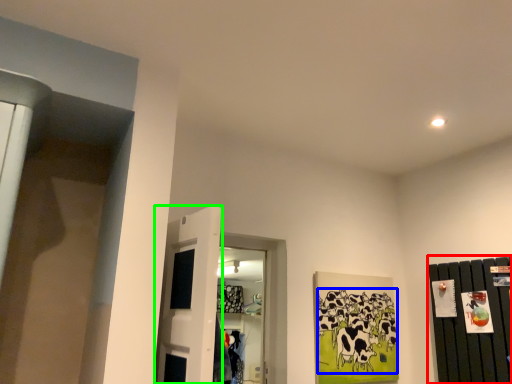
Question: Considering the real-world distances, which object is farthest from dresser (highlighted by a red box)? animal (highlighted by a blue box) or door (highlighted by a green box)?

Choices:
 (A) animal
 (B) door

Answer: (B)